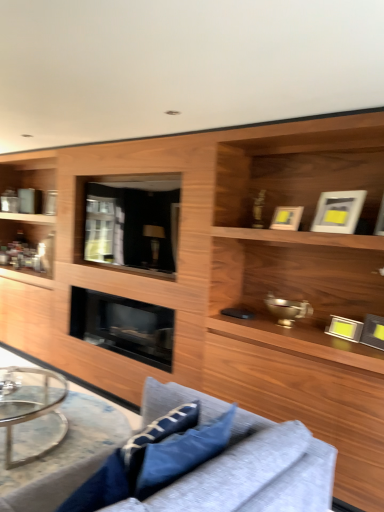
I want to click on blue fabric pillow at lower center, the 1th pillow viewed from the right, so click(182, 452).

The image size is (384, 512). What do you see at coordinates (71, 439) in the screenshot?
I see `clear glass round table at lower left` at bounding box center [71, 439].

The image size is (384, 512). Describe the element at coordinates (129, 223) in the screenshot. I see `transparent glass door at center` at that location.

This screenshot has width=384, height=512. What do you see at coordinates (29, 404) in the screenshot?
I see `clear glass coffee table at lower left` at bounding box center [29, 404].

This screenshot has width=384, height=512. In order to click on black glass fireplace at center in this screenshot , I will do [123, 326].

Identify the location of blue fabric pillow at lower center, acting as the second pillow starting from the left. (182, 452).

From a real-world perspective, between clear glass round table at lower left and blue fabric pillow at lower center, the 1th pillow positioned from the left, who is vertically lower?

From a 3D spatial view, clear glass round table at lower left is below.

Which is closer, (80, 450) or (116, 475)?

Point (80, 450) is farther from the camera than point (116, 475).

In the scene shown: How many degrees apart are the facing directions of clear glass round table at lower left and blue fabric pillow at lower center, positioned as the second pillow in right-to-left order?

They differ by 36 degrees in their facing directions.

Who is more distant, clear glass round table at lower left or blue fabric pillow at lower center, the 1th pillow positioned from the left?

clear glass round table at lower left is more distant.

From the picture: Is clear glass round table at lower left inside clear glass coffee table at lower left?

No, clear glass round table at lower left is not surrounded by clear glass coffee table at lower left.

From a real-world perspective, which object stands above the other?

clear glass coffee table at lower left, from a real-world perspective.

How different are the orientations of clear glass coffee table at lower left and clear glass round table at lower left in degrees?

89.4 degrees.

Based on the photo, which object is more forward, clear glass coffee table at lower left or clear glass round table at lower left?

Positioned in front is clear glass round table at lower left.

From the image's perspective, is blue fabric pillow at lower center, the 1th pillow viewed from the right, under blue fabric pillow at lower center, positioned as the second pillow in right-to-left order?

Actually, blue fabric pillow at lower center, the 1th pillow viewed from the right, appears above blue fabric pillow at lower center, positioned as the second pillow in right-to-left order, in the image.

How many degrees apart are the facing directions of blue fabric pillow at lower center, the 2th pillow viewed from the front, and blue fabric pillow at lower center, the 1th pillow positioned from the left?

They differ by 52.2 degrees in their facing directions.

Considering the sizes of objects blue fabric pillow at lower center, which ranks as the first pillow in back-to-front order, and blue fabric pillow at lower center, the 1th pillow positioned from the left, in the image provided, who is shorter, blue fabric pillow at lower center, which ranks as the first pillow in back-to-front order, or blue fabric pillow at lower center, the 1th pillow positioned from the left,?

With less height is blue fabric pillow at lower center, which ranks as the first pillow in back-to-front order.

Is blue fabric pillow at lower center, the 1th pillow viewed from the right, facing away from blue fabric pillow at lower center, which is counted as the 1th pillow, starting from the front?

blue fabric pillow at lower center, the 1th pillow viewed from the right, does not have its back to blue fabric pillow at lower center, which is counted as the 1th pillow, starting from the front.

Which of these two, black glass fireplace at center or clear glass coffee table at lower left, is wider?

clear glass coffee table at lower left.

Can you confirm if black glass fireplace at center is positioned to the right of clear glass coffee table at lower left?

Yes.

Is clear glass coffee table at lower left completely or partially inside black glass fireplace at center?

No, clear glass coffee table at lower left is not a part of black glass fireplace at center.

Which of these two, black glass fireplace at center or clear glass coffee table at lower left, is smaller?

clear glass coffee table at lower left.

Visually, is transparent glass door at center positioned to the left or to the right of blue fabric pillow at lower center, which ranks as the first pillow in back-to-front order?

transparent glass door at center is positioned on blue fabric pillow at lower center, which ranks as the first pillow in back-to-front order,'s left side.

Between transparent glass door at center and blue fabric pillow at lower center, the 2th pillow viewed from the front, which one has smaller width?

transparent glass door at center.

Is point (131, 266) less distant than point (217, 448)?

No, it is not.

Based on the photo, between clear glass coffee table at lower left and blue fabric pillow at lower center, positioned as the second pillow in right-to-left order, which one has smaller size?

blue fabric pillow at lower center, positioned as the second pillow in right-to-left order, is smaller.

Does clear glass coffee table at lower left lie in front of blue fabric pillow at lower center, which is the second pillow in back-to-front order?

No, clear glass coffee table at lower left is further to the viewer.

Between clear glass coffee table at lower left and blue fabric pillow at lower center, which is counted as the 1th pillow, starting from the front, which one has smaller width?

blue fabric pillow at lower center, which is counted as the 1th pillow, starting from the front.

Would you consider clear glass coffee table at lower left to be distant from blue fabric pillow at lower center, which is counted as the 1th pillow, starting from the front?

Yes, clear glass coffee table at lower left is far from blue fabric pillow at lower center, which is counted as the 1th pillow, starting from the front.

From the image's perspective, is textured gray fabric couch at lower center over black glass fireplace at center?

No, from the image's perspective, textured gray fabric couch at lower center is not over black glass fireplace at center.

Considering the sizes of objects textured gray fabric couch at lower center and black glass fireplace at center in the image provided, who is smaller, textured gray fabric couch at lower center or black glass fireplace at center?

Smaller between the two is black glass fireplace at center.

Is point (219, 471) positioned after point (151, 327)?

No.

Find the location of a particular element. This screenshot has height=512, width=384. round table below the blue fabric pillow at lower center, positioned as the second pillow in right-to-left order (from the image's perspective) is located at coordinates (71, 439).

Where is `coffee table on the left of clear glass round table at lower left`? This screenshot has width=384, height=512. coffee table on the left of clear glass round table at lower left is located at coordinates (29, 404).

From the image, which object appears to be farther from blue fabric pillow at lower center, which is counted as the 1th pillow, starting from the front, transparent glass door at center or blue fabric pillow at lower center, the 2th pillow viewed from the front?

Based on the image, transparent glass door at center appears to be further to blue fabric pillow at lower center, which is counted as the 1th pillow, starting from the front.

Which object lies further to the anchor point transparent glass door at center, blue fabric pillow at lower center, acting as the second pillow starting from the left, or black glass fireplace at center?

The object further to transparent glass door at center is blue fabric pillow at lower center, acting as the second pillow starting from the left.

From the image, which object appears to be farther from clear glass round table at lower left, blue fabric pillow at lower center, acting as the second pillow starting from the left, or black glass fireplace at center?

blue fabric pillow at lower center, acting as the second pillow starting from the left, lies further to clear glass round table at lower left than the other object.

Based on their spatial positions, is blue fabric pillow at lower center, the 2th pillow viewed from the front, or clear glass coffee table at lower left closer to black glass fireplace at center?

Based on the image, clear glass coffee table at lower left appears to be nearer to black glass fireplace at center.

Looking at the image, which one is located further to blue fabric pillow at lower center, positioned as the second pillow in right-to-left order, transparent glass door at center or clear glass round table at lower left?

transparent glass door at center.

From the image, which object appears to be farther from black glass fireplace at center, clear glass round table at lower left or blue fabric pillow at lower center, the 1th pillow positioned from the left?

blue fabric pillow at lower center, the 1th pillow positioned from the left, is further to black glass fireplace at center.

Looking at the image, which one is located closer to clear glass coffee table at lower left, textured gray fabric couch at lower center or clear glass round table at lower left?

clear glass round table at lower left is closer to clear glass coffee table at lower left.

Estimate the real-world distances between objects in this image. Which object is closer to clear glass coffee table at lower left, transparent glass door at center or textured gray fabric couch at lower center?

transparent glass door at center is positioned closer to the anchor clear glass coffee table at lower left.

Where is `pillow between blue fabric pillow at lower center, which is counted as the 1th pillow, starting from the front, and black glass fireplace at center in the front-back direction`? pillow between blue fabric pillow at lower center, which is counted as the 1th pillow, starting from the front, and black glass fireplace at center in the front-back direction is located at coordinates (182, 452).

Identify the location of coffee table between blue fabric pillow at lower center, the 1th pillow viewed from the right, and black glass fireplace at center in the front-back direction. (29, 404).

I want to click on round table between blue fabric pillow at lower center, which ranks as the first pillow in back-to-front order, and black glass fireplace at center in the front-back direction, so click(x=71, y=439).

Image resolution: width=384 pixels, height=512 pixels. In order to click on pillow between textured gray fabric couch at lower center and blue fabric pillow at lower center, the 1th pillow viewed from the right, in the front-back direction in this screenshot , I will do `click(100, 487)`.